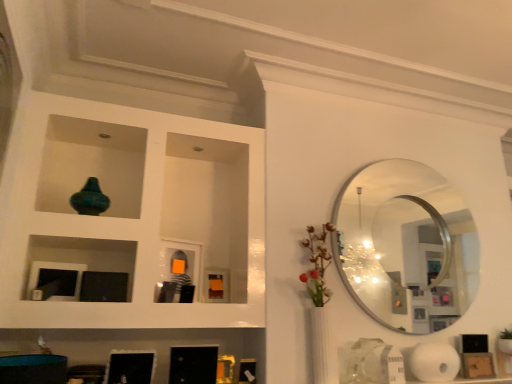
Question: From their relative heights in the image, would you say white matte paper towel at lower right is taller or shorter than silver metallic mirror at upper right?

Choices:
 (A) short
 (B) tall

Answer: (A)

Question: Does point (458, 360) appear closer or farther from the camera than point (347, 208)?

Choices:
 (A) closer
 (B) farther

Answer: (A)

Question: Considering the real-world distances, which object is farthest from the white matte paper towel at lower right?

Choices:
 (A) silver metallic mirror at upper right
 (B) teal glass vase at upper left

Answer: (B)

Question: Which object is positioned closest to the teal glass vase at upper left?

Choices:
 (A) white matte paper towel at lower right
 (B) silver metallic mirror at upper right

Answer: (B)